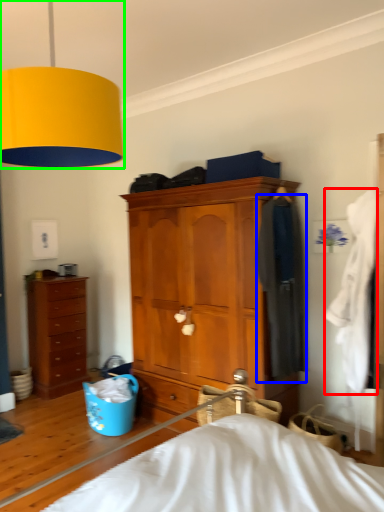
Question: Which object is the farthest from clothing (highlighted by a red box)? Choose among these: clothing (highlighted by a blue box) or lamp (highlighted by a green box).

Choices:
 (A) clothing
 (B) lamp

Answer: (B)